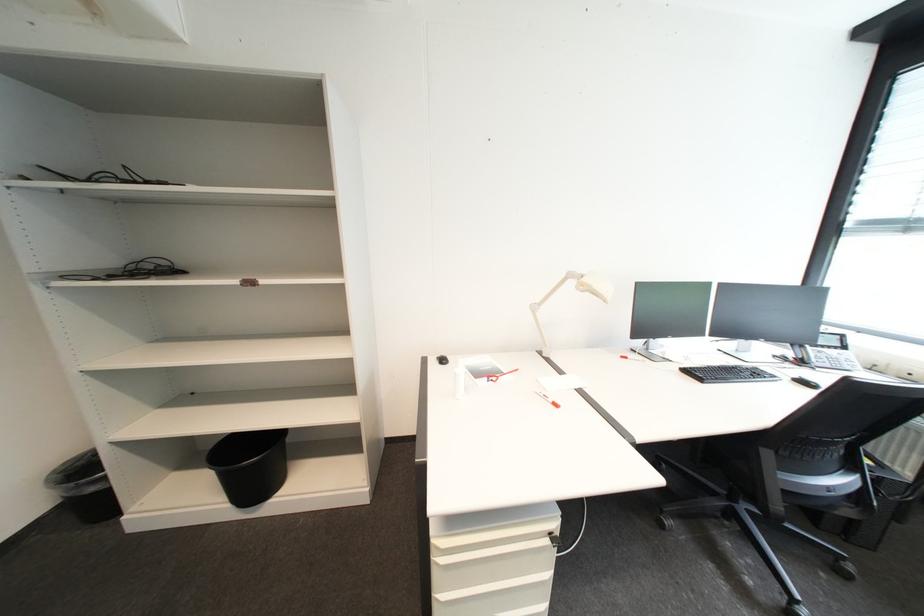
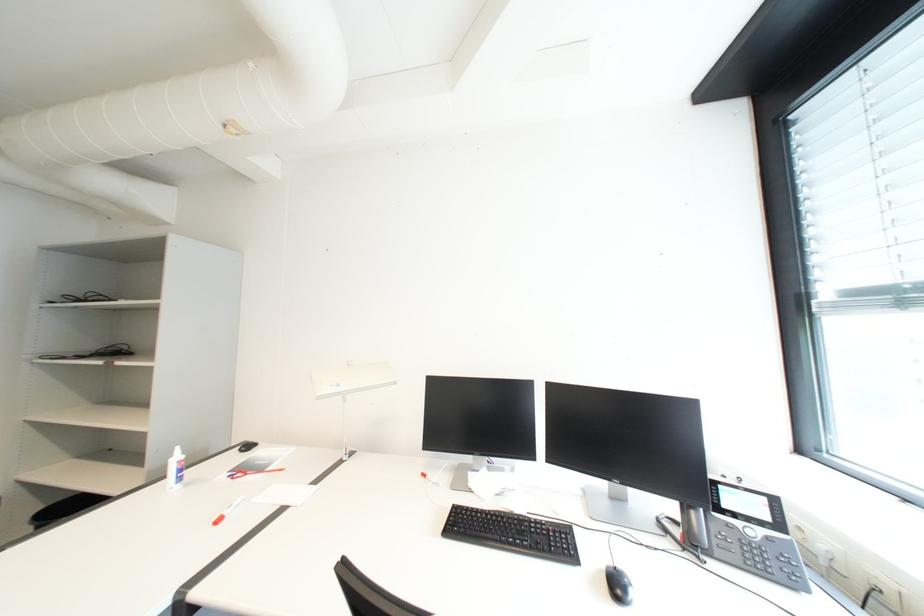
Question: In a continuous first-person perspective shot, in which direction is the camera moving?

Choices:
 (A) Left
 (B) Right
 (C) Forward
 (D) Backward

Answer: (B)